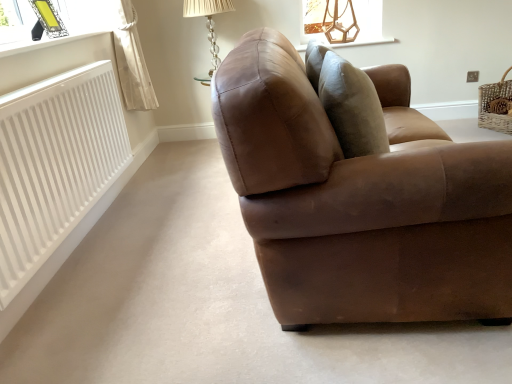
This screenshot has height=384, width=512. What do you see at coordinates (55, 164) in the screenshot? I see `white smooth radiator at left` at bounding box center [55, 164].

Identify the location of wooden at upper center. pyautogui.click(x=362, y=42).

This screenshot has width=512, height=384. What do you see at coordinates (358, 206) in the screenshot? I see `brown leather couch at center` at bounding box center [358, 206].

What do you see at coordinates (496, 105) in the screenshot? I see `white wicker basket at right` at bounding box center [496, 105].

Identify the location of translucent glass table lamp at upper center. Image resolution: width=512 pixels, height=384 pixels. (208, 26).

Is translucent glass table lamp at upper center outside of white wicker basket at right?

Yes, translucent glass table lamp at upper center is not within white wicker basket at right.

Which object is further away from the camera, translucent glass table lamp at upper center or white wicker basket at right?

white wicker basket at right is more distant.

Would you say translucent glass table lamp at upper center is to the left or to the right of white wicker basket at right in the picture?

Based on their positions, translucent glass table lamp at upper center is located to the left of white wicker basket at right.

Considering the positions of objects white wicker basket at right and brown leather couch at center in the image provided, who is more to the right, white wicker basket at right or brown leather couch at center?

Positioned to the right is white wicker basket at right.

From a real-world perspective, is white wicker basket at right over brown leather couch at center?

Actually, white wicker basket at right is physically below brown leather couch at center in the real world.

In the scene shown: Which is more distant, (503,82) or (362,186)?

The point (503,82) is farther.

From the image's perspective, which one is positioned lower, white wicker basket at right or brown leather couch at center?

From the image's view, brown leather couch at center is below.

Is wooden at upper center facing towards white wicker basket at right?

No, wooden at upper center is not facing towards white wicker basket at right.

Would you say wooden at upper center contains white wicker basket at right?

No, white wicker basket at right is not surrounded by wooden at upper center.

Is point (336, 44) positioned after point (482, 105)?

Yes.

Can you confirm if wooden at upper center is smaller than white wicker basket at right?

Yes.

Is translucent glass table lamp at upper center at the left side of wooden at upper center?

Indeed, translucent glass table lamp at upper center is positioned on the left side of wooden at upper center.

How different are the orientations of translucent glass table lamp at upper center and wooden at upper center in degrees?

translucent glass table lamp at upper center and wooden at upper center are facing 0.000422 degrees away from each other.

Looking at this image, between translucent glass table lamp at upper center and wooden at upper center, which one is positioned behind?

wooden at upper center.

In terms of size, does translucent glass table lamp at upper center appear bigger or smaller than wooden at upper center?

translucent glass table lamp at upper center is bigger than wooden at upper center.

Between wooden at upper center and white smooth radiator at left, which one is positioned behind?

Positioned behind is wooden at upper center.

Does wooden at upper center touch white smooth radiator at left?

No, wooden at upper center is not making contact with white smooth radiator at left.

Which object is positioned more to the right, wooden at upper center or white smooth radiator at left?

wooden at upper center is more to the right.

Between wooden at upper center and white smooth radiator at left, which one has smaller size?

wooden at upper center is smaller.

How distant is brown leather couch at center from wooden at upper center?

A distance of 2.18 meters exists between brown leather couch at center and wooden at upper center.

From the image's perspective, which is above, brown leather couch at center or wooden at upper center?

wooden at upper center, from the image's perspective.

Is wooden at upper center located within brown leather couch at center?

No.

Between brown leather couch at center and wooden at upper center, which one has more height?

With more height is brown leather couch at center.

Between white wicker basket at right and translucent glass table lamp at upper center, which one has less height?

With less height is white wicker basket at right.

Is white wicker basket at right outside of translucent glass table lamp at upper center?

Yes, white wicker basket at right is outside of translucent glass table lamp at upper center.

Is white wicker basket at right at the right side of translucent glass table lamp at upper center?

Yes.

Which object is wider, white wicker basket at right or translucent glass table lamp at upper center?

With larger width is translucent glass table lamp at upper center.

Find the location of `basket that appears behind the translucent glass table lamp at upper center`. basket that appears behind the translucent glass table lamp at upper center is located at coordinates (x=496, y=105).

I want to click on basket located on the right of brown leather couch at center, so (496, 105).

Looking at the image, which one is located closer to translucent glass table lamp at upper center, brown leather couch at center or white wicker basket at right?

white wicker basket at right is positioned closer to the anchor translucent glass table lamp at upper center.

When comparing their distances from brown leather couch at center, does wooden at upper center or white smooth radiator at left seem closer?

Based on the image, white smooth radiator at left appears to be nearer to brown leather couch at center.

Looking at the image, which one is located closer to translucent glass table lamp at upper center, white smooth radiator at left or white wicker basket at right?

white smooth radiator at left lies closer to translucent glass table lamp at upper center than the other object.

Considering their positions, is white smooth radiator at left positioned closer to translucent glass table lamp at upper center than brown leather couch at center?

white smooth radiator at left is positioned closer to the anchor translucent glass table lamp at upper center.

From the image, which object appears to be nearer to white smooth radiator at left, translucent glass table lamp at upper center or white wicker basket at right?

translucent glass table lamp at upper center.

Based on their spatial positions, is wooden at upper center or white smooth radiator at left closer to translucent glass table lamp at upper center?

wooden at upper center is positioned closer to the anchor translucent glass table lamp at upper center.

From the image, which object appears to be farther from white wicker basket at right, brown leather couch at center or translucent glass table lamp at upper center?

Based on the image, brown leather couch at center appears to be further to white wicker basket at right.

Estimate the real-world distances between objects in this image. Which object is further from wooden at upper center, white wicker basket at right or translucent glass table lamp at upper center?

white wicker basket at right is further to wooden at upper center.

Where is `table lamp between brown leather couch at center and wooden at upper center in the front-back direction`? This screenshot has height=384, width=512. table lamp between brown leather couch at center and wooden at upper center in the front-back direction is located at coordinates (208, 26).

What are the coordinates of `radiator positioned between brown leather couch at center and translucent glass table lamp at upper center from near to far` in the screenshot? It's located at (55, 164).

What are the coordinates of `studio couch between translucent glass table lamp at upper center and white wicker basket at right in the horizontal direction` in the screenshot? It's located at (358, 206).

The height and width of the screenshot is (384, 512). In order to click on window sill between white smooth radiator at left and white wicker basket at right from left to right in this screenshot , I will do `click(362, 42)`.